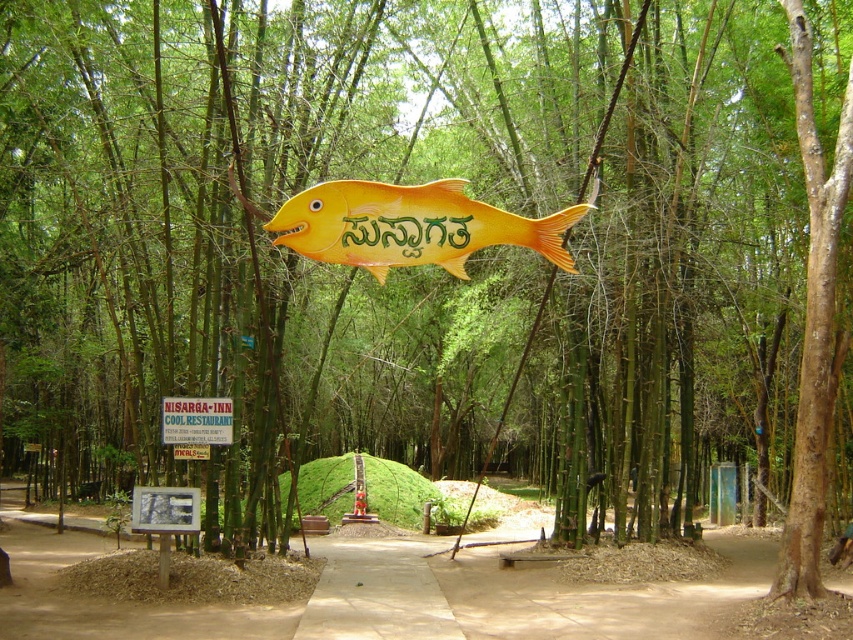
Question: Is matte yellow fish at center wider than green plastic signboard at center?

Choices:
 (A) no
 (B) yes

Answer: (B)

Question: Which point is closer to the camera taking this photo?

Choices:
 (A) (486, 220)
 (B) (200, 397)

Answer: (A)

Question: Does matte yellow fish at center come in front of green plastic signboard at center?

Choices:
 (A) no
 (B) yes

Answer: (B)

Question: From the image, what is the correct spatial relationship of matte yellow fish at center in relation to green plastic signboard at center?

Choices:
 (A) left
 (B) right

Answer: (B)